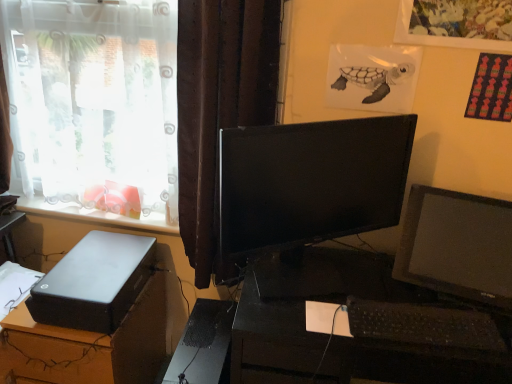
Question: From a real-world perspective, is white plastic window sill at lower left physically located above or below satin black desktop at lower left, which is counted as the 2th desk, starting from the right?

Choices:
 (A) below
 (B) above

Answer: (B)

Question: Is white plastic window sill at lower left to the left or to the right of satin black desktop at lower left, which is counted as the 2th desk, starting from the right, in the image?

Choices:
 (A) right
 (B) left

Answer: (B)

Question: Based on their relative distances, which object is nearer to the black plastic keyboard at lower right?

Choices:
 (A) satin black desktop at lower left, which is counted as the 2th desk, starting from the right
 (B) matte black hard drive at lower left
 (C) black matte computer tower at lower left
 (D) black glossy monitor at center
 (E) brown textured curtain at center

Answer: (D)

Question: Which object is the farthest from the black glossy monitor at center?

Choices:
 (A) satin black desktop at lower left, which is counted as the 2th desk, starting from the right
 (B) black plastic keyboard at lower right
 (C) black plastic desk at center, the second desk from the left
 (D) matte black hard drive at lower left
 (E) white plastic window sill at lower left

Answer: (A)